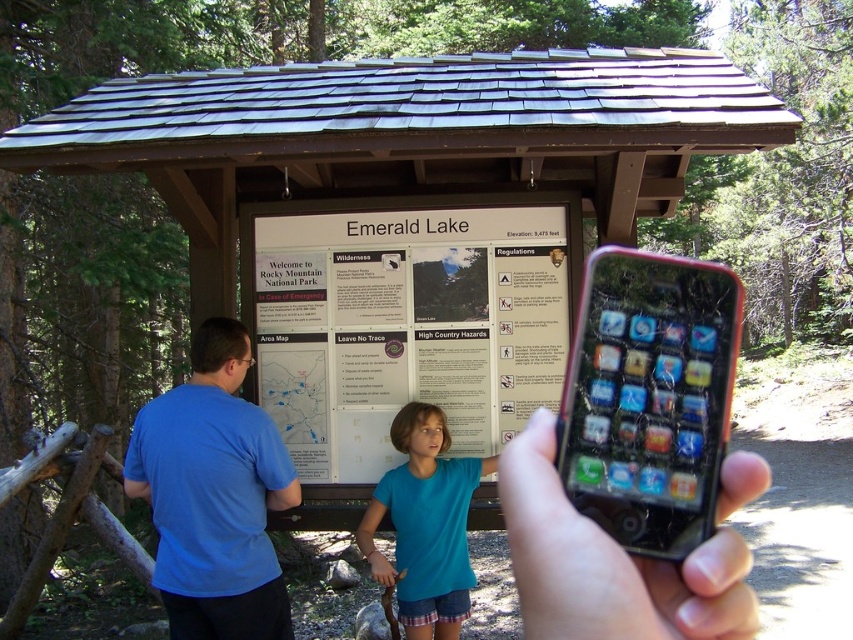
You are a hiker who just arrived at the Emerald Lake shelter. You want to check the map to plan your route. However, your cracked glass smartphone at center is on the ground. Can you reach it without moving from your current position?

The cracked glass smartphone at center is located at point (648, 397), which is within your reach while standing at the shelter. Yes, you can reach it without moving.

You are a hiker who just arrived at Emerald Lake. You want to check the map on your cracked glass smartphone at center but notice the blue cotton shirt at left is in the way. Can you move the smartphone down to access the map?

The cracked glass smartphone at center is located above the blue cotton shirt at left, so moving it down would bring it closer to or in contact with the shirt, potentially blocking access to the map.